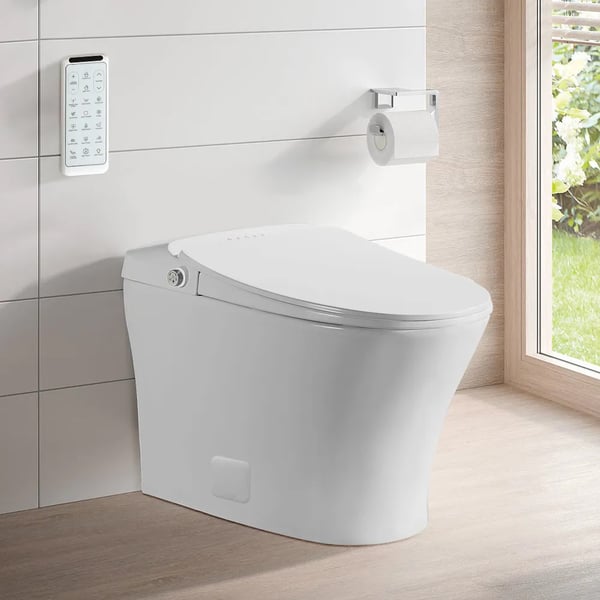
Locate an element on the screen. The height and width of the screenshot is (600, 600). toilet is located at coordinates (250, 357).